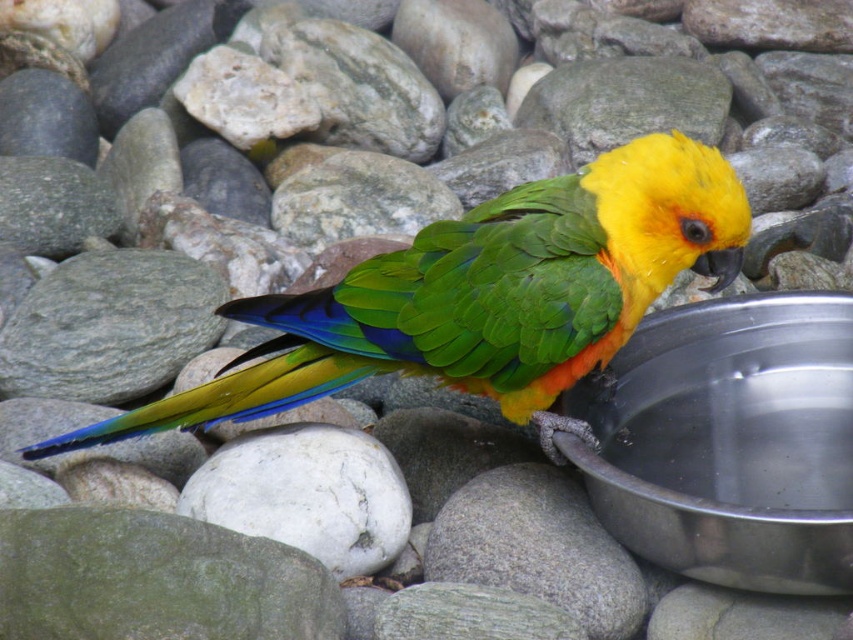
Question: Does shiny green parrot at center appear under metallic silver basin at lower right?

Choices:
 (A) no
 (B) yes

Answer: (A)

Question: Can you confirm if shiny green parrot at center is wider than metallic silver basin at lower right?

Choices:
 (A) no
 (B) yes

Answer: (B)

Question: Which of the following is the farthest from the observer?

Choices:
 (A) metallic silver basin at lower right
 (B) shiny green parrot at center

Answer: (B)

Question: Does shiny green parrot at center appear over metallic silver basin at lower right?

Choices:
 (A) no
 (B) yes

Answer: (B)